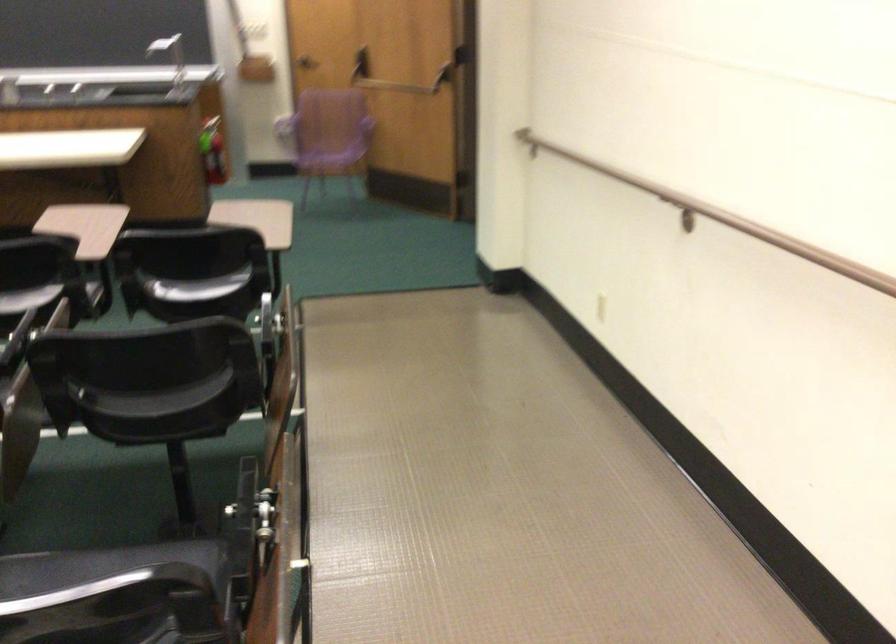
Describe the element at coordinates (71, 565) in the screenshot. I see `the purple chair sitting surface` at that location.